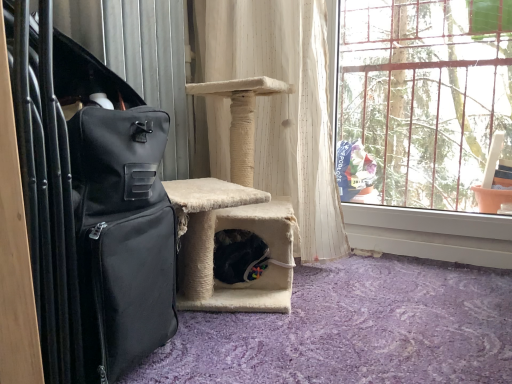
Question: Considering the positions of clear glass window at upper right and white textured curtain at center in the image, is clear glass window at upper right taller or shorter than white textured curtain at center?

Choices:
 (A) short
 (B) tall

Answer: (A)

Question: Is clear glass window at upper right to the left or to the right of white textured curtain at center in the image?

Choices:
 (A) right
 (B) left

Answer: (A)

Question: Which is farther from the white textured curtain at center?

Choices:
 (A) clear glass window at upper right
 (B) black fabric suitcase at left

Answer: (B)

Question: Which object is positioned farthest from the clear glass window at upper right?

Choices:
 (A) black fabric suitcase at left
 (B) white textured curtain at center

Answer: (A)